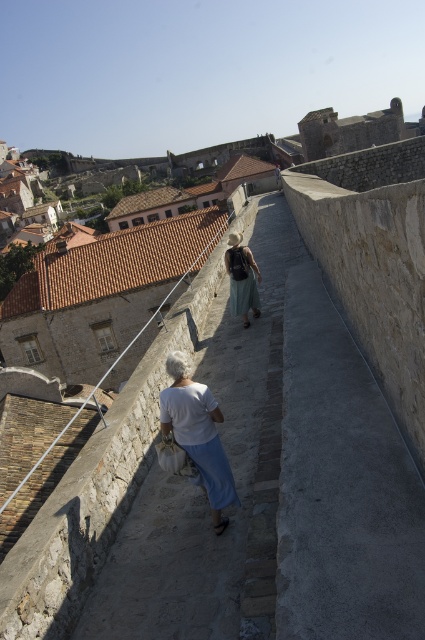
Question: Which point is farther to the camera?

Choices:
 (A) white cotton shirt at center
 (B) light green fabric dress at center

Answer: (B)

Question: Does white cotton shirt at center appear under light green fabric dress at center?

Choices:
 (A) no
 (B) yes

Answer: (B)

Question: Where is white cotton shirt at center located in relation to light green fabric dress at center in the image?

Choices:
 (A) above
 (B) below

Answer: (B)

Question: Does white cotton shirt at center appear on the left side of light green fabric dress at center?

Choices:
 (A) no
 (B) yes

Answer: (B)